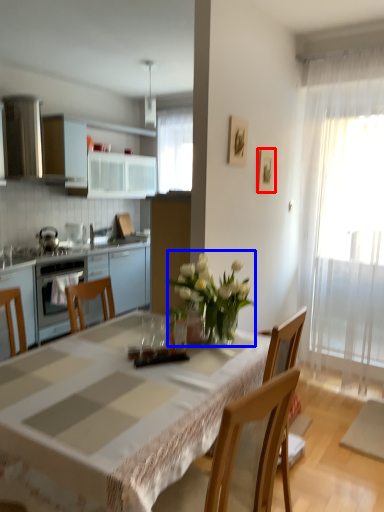
Question: Among these objects, which one is farthest to the camera, picture frame (highlighted by a red box) or floral arrangement (highlighted by a blue box)?

Choices:
 (A) picture frame
 (B) floral arrangement

Answer: (A)